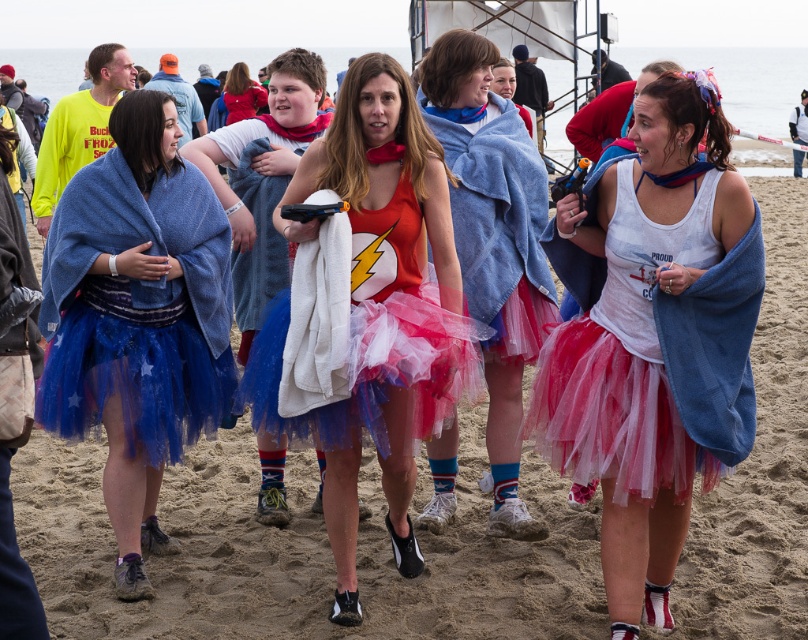
You are organizing a costume parade and need to arrange the blue tulle skirt at left and the matte blue tutu at center based on their height. Which one should be placed first in the lineup if you want the tallest costume to lead?

The blue tulle skirt at left is taller than the matte blue tutu at center, so it should be placed first in the lineup to lead the parade.

You are standing at the center of the beach event and notice the shiny red tank top at center. Where exactly is it positioned relative to your current location?

The shiny red tank top at center is located at point coordinates 0.489 along the horizontal axis and 0.455 along the vertical axis, meaning it is slightly to the right and just below the center point from your current position.